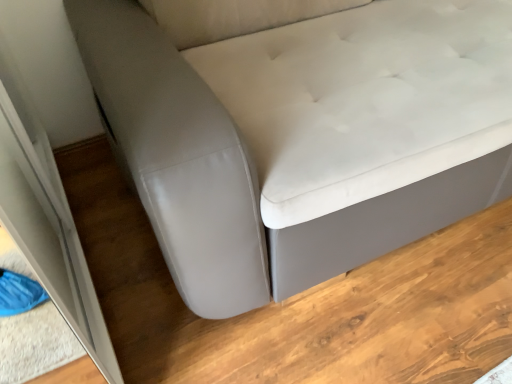
Measure the distance between point (162, 89) and camera.

Point (162, 89) and camera are 31.97 inches apart from each other.

Where is `satin gray sofa at center`? The image size is (512, 384). satin gray sofa at center is located at coordinates (304, 137).

This screenshot has height=384, width=512. What do you see at coordinates (304, 137) in the screenshot?
I see `satin gray sofa at center` at bounding box center [304, 137].

The width and height of the screenshot is (512, 384). I want to click on satin gray sofa at center, so click(304, 137).